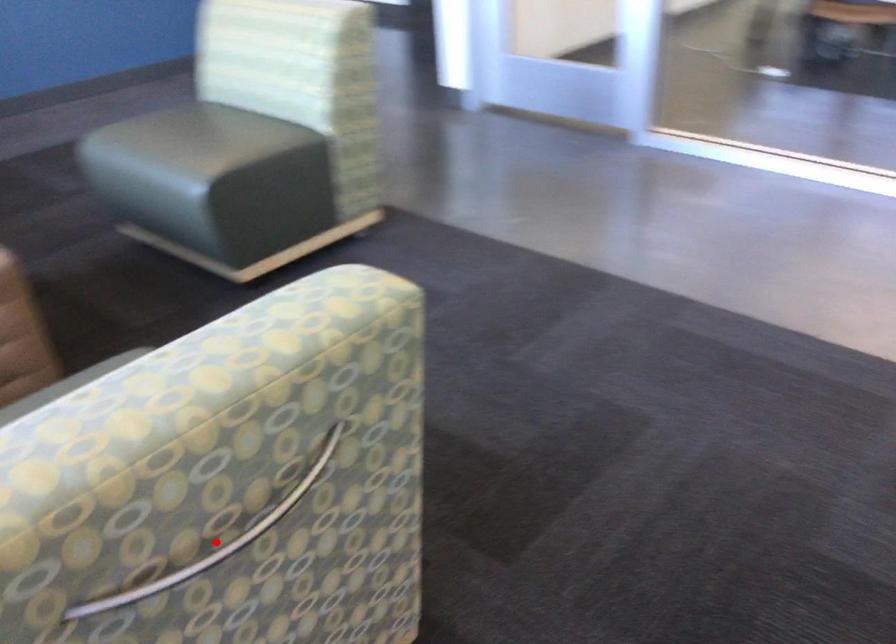
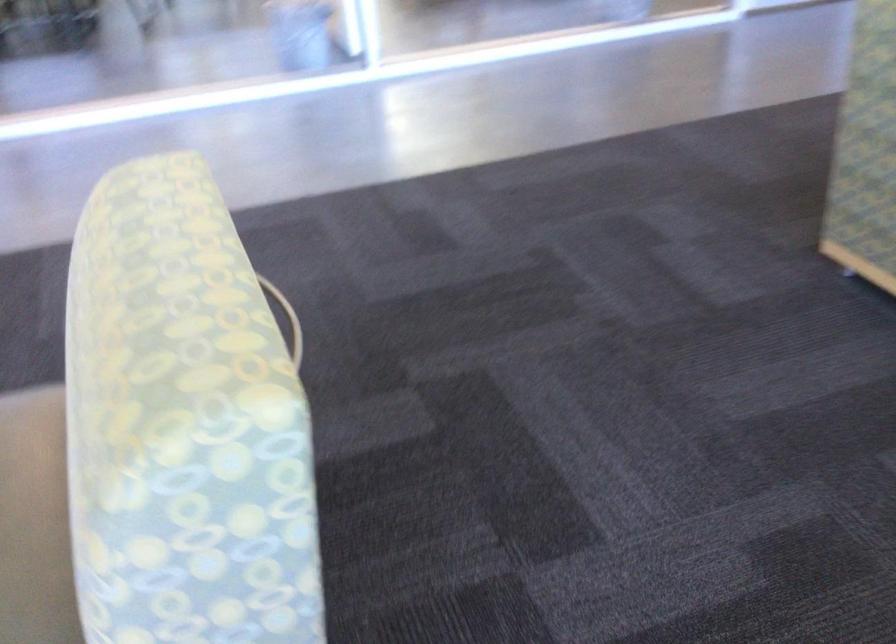
Question: I am providing you with two images of the same scene from different viewpoints. A red point is marked on the first image. Can you still see the location of the red point in image 2?

Choices:
 (A) Yes
 (B) No

Answer: (B)